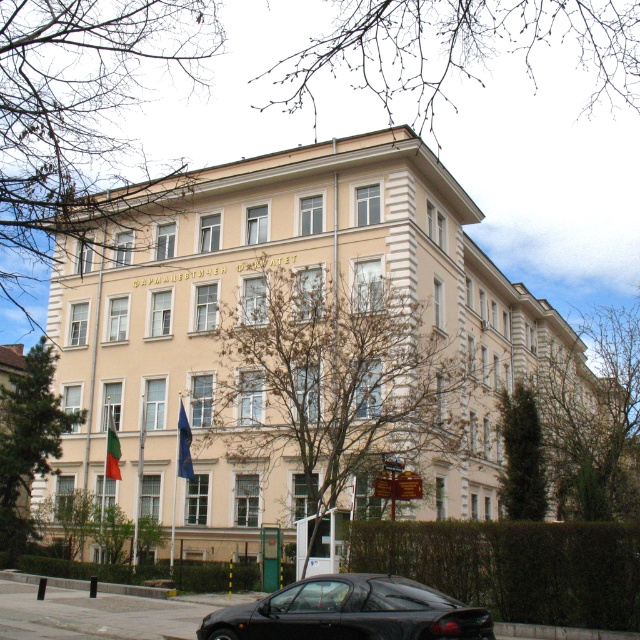
Question: Which object appears closest to the camera in this image?

Choices:
 (A) red fabric flag at center
 (B) beige stone building at center

Answer: (B)

Question: Which point is closer to the camera taking this photo?

Choices:
 (A) (115, 468)
 (B) (218, 625)
 (C) (188, 444)
 (D) (332, 470)

Answer: (B)

Question: Is beige stone building at center to the right of blue fabric flag at center from the viewer's perspective?

Choices:
 (A) no
 (B) yes

Answer: (B)

Question: From the image, what is the correct spatial relationship of black matte car at lower center in relation to red fabric flag at center?

Choices:
 (A) right
 (B) left

Answer: (A)

Question: Among these objects, which one is farthest from the camera?

Choices:
 (A) red fabric flag at center
 (B) beige stone building at center
 (C) blue fabric flag at center
 (D) black matte car at lower center

Answer: (C)

Question: Observing the image, what is the correct spatial positioning of blue fabric flag at center in reference to red fabric flag at center?

Choices:
 (A) left
 (B) right

Answer: (B)